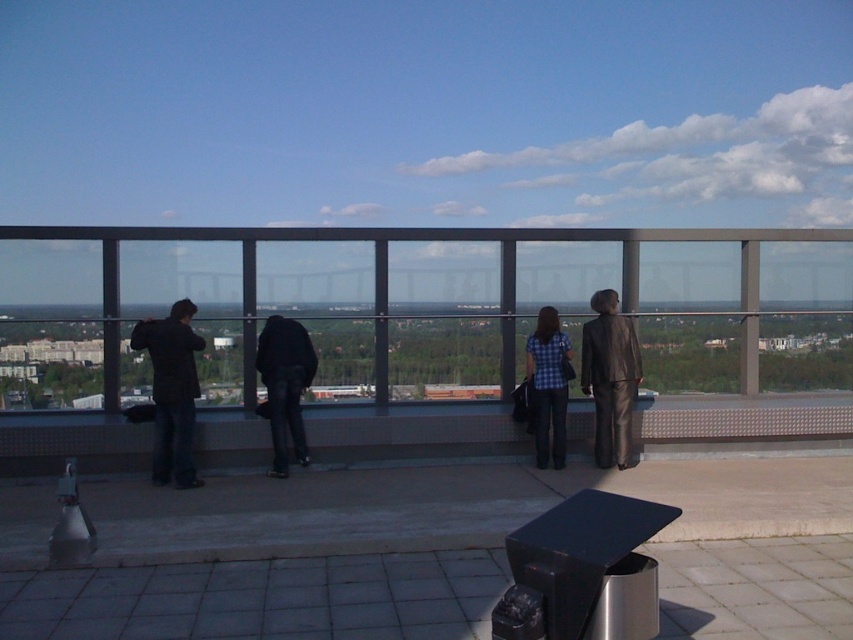
You are a photographer trying to capture a group photo of the black matte jacket at left and the blue plaid shirt at center. If you want to ensure both subjects are fully visible in the frame, which person should you position closer to the camera?

The black matte jacket at left is wider than the blue plaid shirt at center, so you should position the black matte jacket at left closer to the camera to ensure both are fully visible.

You are standing at the point labeled point (543, 381) on the rooftop observation deck. You want to move towards the point labeled point (173, 468). Will you be moving forward or backward relative to your current position?

Since point (173, 468) is in front of point (543, 381), moving towards it would mean moving forward from your current position.

You are standing on the rooftop observation deck and want to place a new bench at coordinate point 0.6, 0.7. Is there enough space to place it there without overlapping the shiny brown suit at right?

The shiny brown suit at right is located at point (610, 378), which is very close to the desired coordinate (596, 384). Placing the bench there may cause overlap, so it is not advisable.